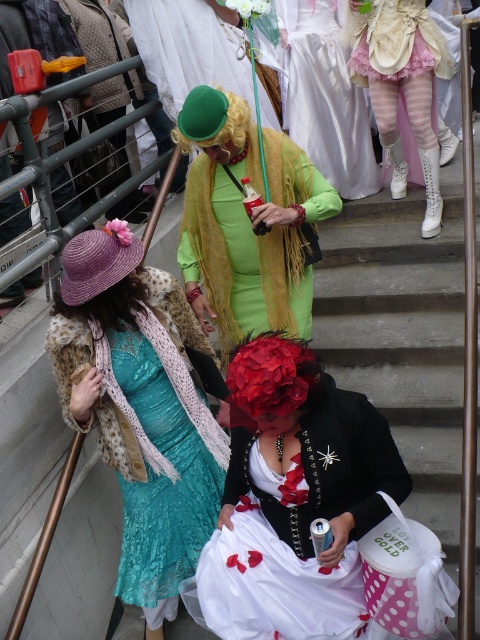
You are standing at the bottom of the staircase and want to hand a flower to the teal lace dress at center and the purple straw wig at lower left. Which one can you reach first without moving closer?

The purple straw wig at lower left can be reached first because it is closer to you than the teal lace dress at center.

You are standing on the staircase and want to take a photo of the teal lace dress at center and the purple straw wig at lower left. Which one is closer to the camera?

The teal lace dress at center is in front of the purple straw wig at lower left, so it is closer to the camera.